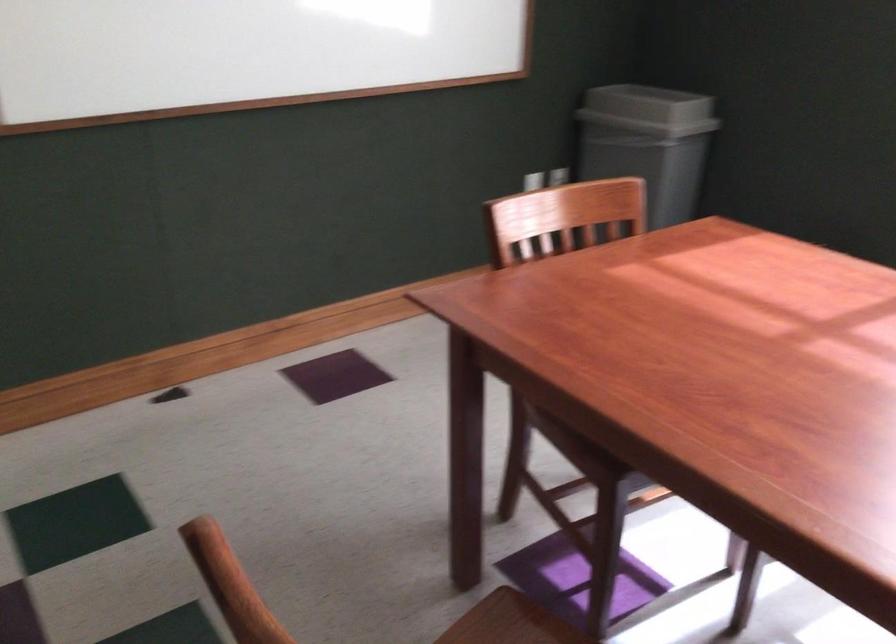
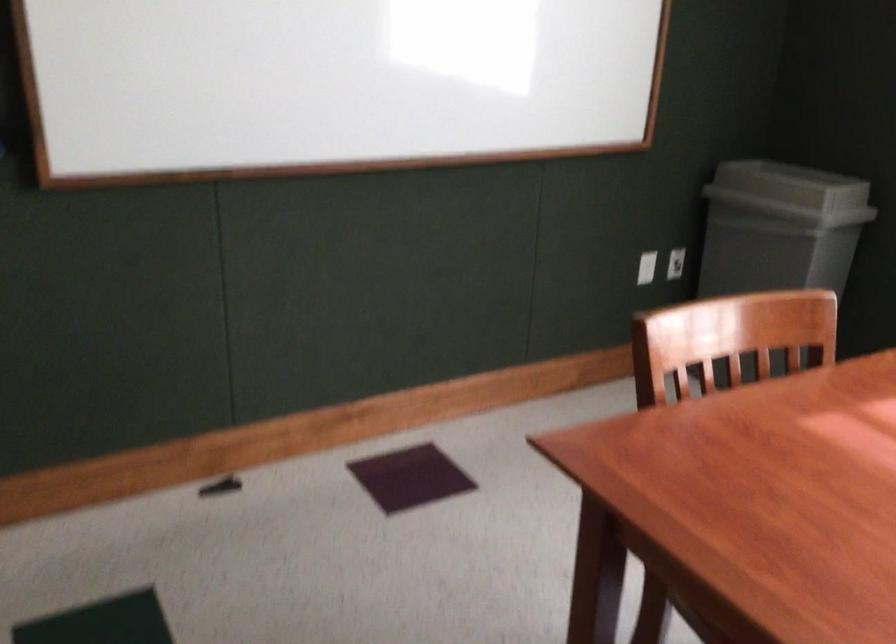
The point at (554,182) is marked in the first image. Where is the corresponding point in the second image?

(675, 263)